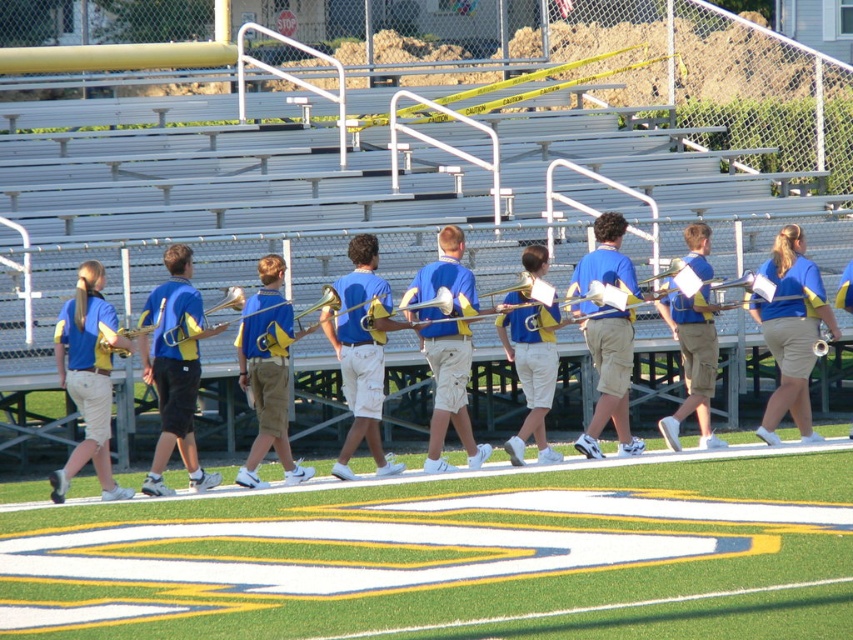
Does gold/yellow brass trombone at center come behind shiny gold trombone at center?

Yes, it is behind shiny gold trombone at center.

Is gold/yellow brass trombone at center shorter than shiny gold trombone at center?

No, gold/yellow brass trombone at center is not shorter than shiny gold trombone at center.

Identify the location of gold/yellow brass trombone at center. The height and width of the screenshot is (640, 853). (276, 339).

Identify the location of gold/yellow brass trombone at center. The image size is (853, 640). (276, 339).

Is matte blue shirt at left to the right of shiny gold trombone at center from the viewer's perspective?

No, matte blue shirt at left is not to the right of shiny gold trombone at center.

Is matte blue shirt at left wider than shiny gold trombone at center?

Yes, matte blue shirt at left is wider than shiny gold trombone at center.

This screenshot has width=853, height=640. Describe the element at coordinates (88, 378) in the screenshot. I see `matte blue shirt at left` at that location.

Where is `matte blue shirt at left`? The width and height of the screenshot is (853, 640). matte blue shirt at left is located at coordinates (88, 378).

Who is more forward, (285, 348) or (131, 332)?

Point (131, 332)

Looking at this image, can you confirm if gold/yellow brass trombone at center is positioned below matte brass trombone at left?

Actually, gold/yellow brass trombone at center is above matte brass trombone at left.

Is point (265, 346) closer to viewer compared to point (146, 326)?

Yes, it is in front of point (146, 326).

Where is `gold/yellow brass trombone at center`? Image resolution: width=853 pixels, height=640 pixels. gold/yellow brass trombone at center is located at coordinates (276, 339).